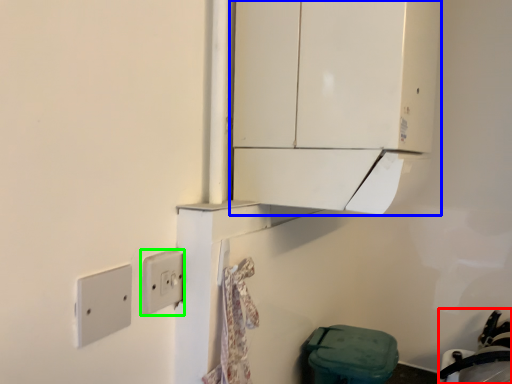
Question: Which object is positioned closest to sink (highlighted by a red box)? Select from cabinetry (highlighted by a blue box) and light switch (highlighted by a green box).

Choices:
 (A) cabinetry
 (B) light switch

Answer: (A)